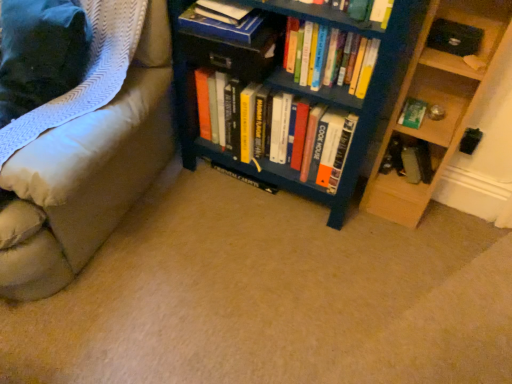
Question: Is green matte book at right, which appears as the second book when viewed from the right, at the back of wooden at right?

Choices:
 (A) no
 (B) yes

Answer: (B)

Question: Is wooden at right positioned before green matte book at right, which appears as the second book when viewed from the right?

Choices:
 (A) yes
 (B) no

Answer: (A)

Question: Does wooden at right contain green matte book at right, the fifth book positioned from the left?

Choices:
 (A) yes
 (B) no

Answer: (A)

Question: Does wooden at right have a greater width compared to green matte book at right, which appears as the second book when viewed from the right?

Choices:
 (A) yes
 (B) no

Answer: (A)

Question: From a real-world perspective, is wooden at right located beneath green matte book at right, which appears as the second book when viewed from the right?

Choices:
 (A) yes
 (B) no

Answer: (A)

Question: From a real-world perspective, is wooden at right on top of green matte book at right, which appears as the second book when viewed from the right?

Choices:
 (A) no
 (B) yes

Answer: (A)

Question: Does white textured blanket at left appear on the left side of hardcover books at center, which is the third book in right-to-left order?

Choices:
 (A) no
 (B) yes

Answer: (B)

Question: Can hardcover books at center, the fourth book from the left, be found inside white textured blanket at left?

Choices:
 (A) yes
 (B) no

Answer: (B)

Question: Is white textured blanket at left located outside hardcover books at center, the fourth book from the left?

Choices:
 (A) no
 (B) yes

Answer: (B)

Question: Can you confirm if white textured blanket at left is wider than hardcover books at center, which is the third book in right-to-left order?

Choices:
 (A) yes
 (B) no

Answer: (A)

Question: Is white textured blanket at left behind hardcover books at center, the fourth book from the left?

Choices:
 (A) yes
 (B) no

Answer: (B)

Question: Does white textured blanket at left lie in front of hardcover books at center, which is the third book in right-to-left order?

Choices:
 (A) no
 (B) yes

Answer: (B)

Question: From the image's perspective, is wooden at right on top of hardcover book at upper center, the 1th book viewed from the left?

Choices:
 (A) yes
 (B) no

Answer: (B)